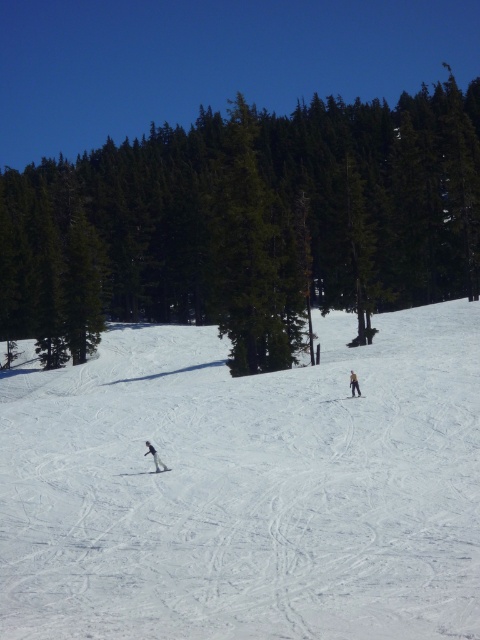
You are a photographer standing at the camera position. You want to take a photo of the green evergreen tree at center. The camera has a focal length of 50mm. If you move 50 feet closer to the tree, what will happen to the size of the tree in the photo?

Moving 50 feet closer to the green evergreen tree at center would decrease the distance from 167.96 feet to 117.96 feet. This would make the tree appear larger in the photo because objects closer to the camera appear larger in the image.